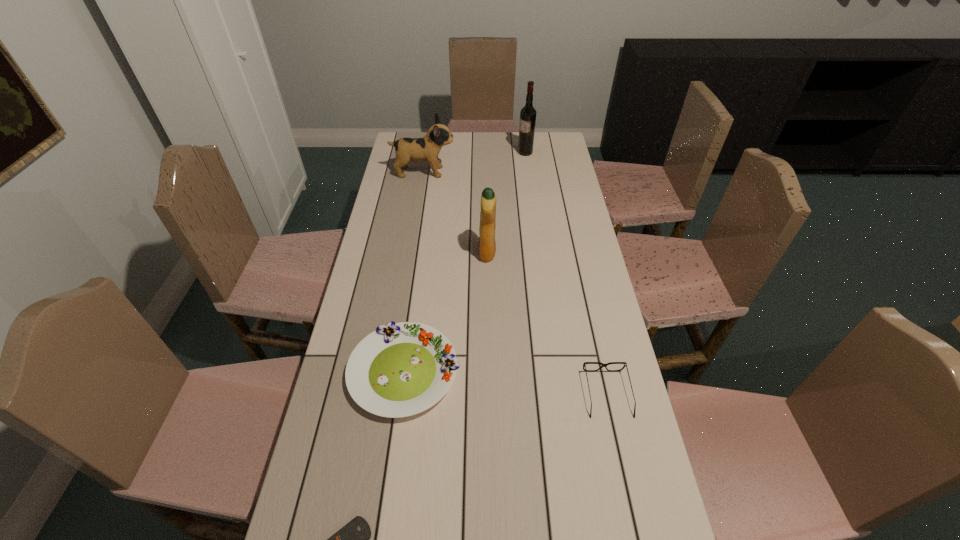
You are a GUI agent. You are given a task and a screenshot of the screen. Output one action in this format:
    pyautogui.click(x=<x>, y=<y>)
    Task: Click on the spectacles located at the right edge
    The width and height of the screenshot is (960, 540).
    Given the screenshot: What is the action you would take?
    pyautogui.click(x=625, y=364)

Where is `object that is at the far right corner`? This screenshot has height=540, width=960. object that is at the far right corner is located at coordinates (528, 113).

Where is `free point at the left edge`? free point at the left edge is located at coordinates (385, 215).

This screenshot has height=540, width=960. In the image, there is a desktop. Identify the location of free space at the right edge. (608, 411).

You are a GUI agent. You are given a task and a screenshot of the screen. Output one action in this format:
    pyautogui.click(x=<x>, y=<y>)
    Task: Click on the vacant space that's between the salad plate and the fifth nearest object
    
    Given the screenshot: What is the action you would take?
    pyautogui.click(x=414, y=272)

What are the coordinates of `vacant space that is in between the detergent and the puppy` in the screenshot? It's located at (455, 213).

The width and height of the screenshot is (960, 540). In order to click on free space between the rightmost object and the second farthest object in this screenshot , I will do `click(516, 283)`.

This screenshot has width=960, height=540. Find the location of `vacant point located between the fourth object from left to right and the fifth object from left to right`. vacant point located between the fourth object from left to right and the fifth object from left to right is located at coordinates (506, 202).

The height and width of the screenshot is (540, 960). I want to click on free space between the salad plate and the fifth object from left to right, so click(x=465, y=262).

This screenshot has width=960, height=540. Find the location of `vacant space in between the fifth nearest object and the rightmost object`. vacant space in between the fifth nearest object and the rightmost object is located at coordinates (516, 283).